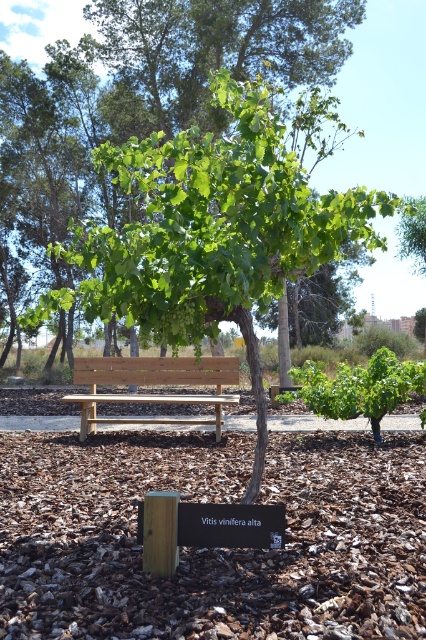
Question: Where is green leafy tree at center located in relation to wooden bench at center in the image?

Choices:
 (A) right
 (B) left

Answer: (A)

Question: Does green leafy tree at center lie behind wooden bench at center?

Choices:
 (A) yes
 (B) no

Answer: (B)

Question: Among these objects, which one is nearest to the camera?

Choices:
 (A) green leafy tree at center
 (B) wooden bench at center

Answer: (A)

Question: Which point appears closest to the camera in this image?

Choices:
 (A) (196, 240)
 (B) (135, 420)

Answer: (A)

Question: Can you confirm if green leafy tree at center is positioned below wooden bench at center?

Choices:
 (A) no
 (B) yes

Answer: (A)